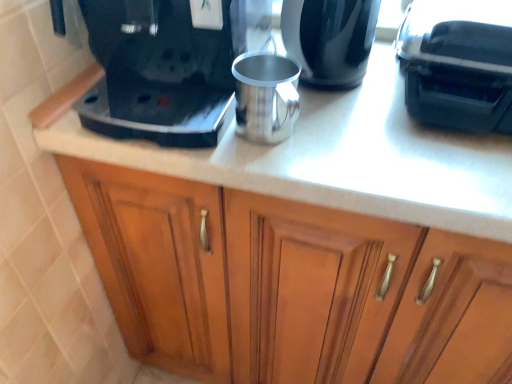
The image size is (512, 384). Find the location of `free point to the right of polished metal mug at center`. free point to the right of polished metal mug at center is located at coordinates (377, 144).